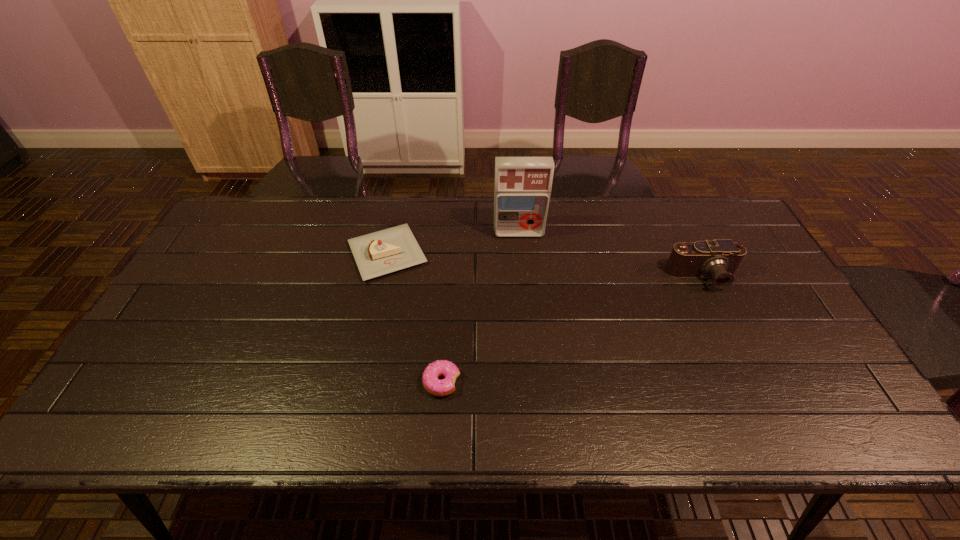
This screenshot has height=540, width=960. Identify the location of free spot located on the left of the leftmost object. (232, 254).

The width and height of the screenshot is (960, 540). Find the location of `free region located on the left of the doughnut`. free region located on the left of the doughnut is located at coordinates (305, 382).

Image resolution: width=960 pixels, height=540 pixels. Find the location of `the first-aid kit present at the far edge`. the first-aid kit present at the far edge is located at coordinates (523, 185).

The width and height of the screenshot is (960, 540). Find the location of `cake positioned at the far edge`. cake positioned at the far edge is located at coordinates (389, 250).

Locate an element on the screen. The width and height of the screenshot is (960, 540). object that is at the right edge is located at coordinates (720, 258).

This screenshot has width=960, height=540. Find the location of `vacant space at the far edge of the desktop`. vacant space at the far edge of the desktop is located at coordinates (454, 201).

What are the coordinates of `vacant space at the near edge` in the screenshot? It's located at (722, 408).

In the image, there is a desktop. Where is `free space at the left edge`? free space at the left edge is located at coordinates (210, 244).

You are a GUI agent. You are given a task and a screenshot of the screen. Output one action in this format:
    pyautogui.click(x=<x>, y=<y>)
    Task: Click on the vacant space at the right edge of the desktop
    Image resolution: width=960 pixels, height=540 pixels.
    Given the screenshot: What is the action you would take?
    pyautogui.click(x=753, y=300)

In order to click on free point at the far left corner in this screenshot , I will do `click(275, 218)`.